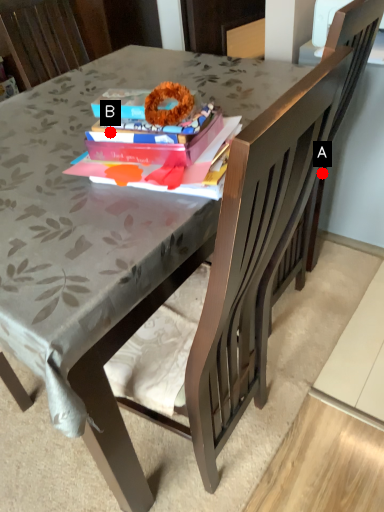
Question: Two points are circled on the image, labeled by A and B beside each circle. Which point is closer to the camera?

Choices:
 (A) A is closer
 (B) B is closer

Answer: (B)